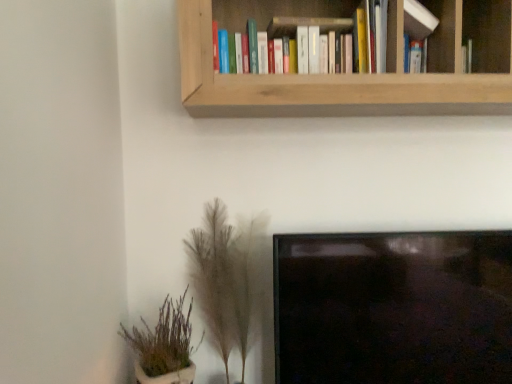
Question: Considering the relative sizes of green leafy plant at lower left, which is the 1th houseplant from left to right, and white matte book at upper right, the 2th book positioned from the left, in the image provided, is green leafy plant at lower left, which is the 1th houseplant from left to right, wider than white matte book at upper right, the 2th book positioned from the left,?

Choices:
 (A) no
 (B) yes

Answer: (B)

Question: Can you confirm if green leafy plant at lower left, which is the 1th houseplant from left to right, is positioned to the right of white matte book at upper right, marked as the first book in a right-to-left arrangement?

Choices:
 (A) yes
 (B) no

Answer: (B)

Question: Considering the relative sizes of green leafy plant at lower left, which is the 1th houseplant from left to right, and white matte book at upper right, the 2th book positioned from the left, in the image provided, is green leafy plant at lower left, which is the 1th houseplant from left to right, taller than white matte book at upper right, the 2th book positioned from the left,?

Choices:
 (A) no
 (B) yes

Answer: (B)

Question: Would you consider green leafy plant at lower left, the 2th houseplant from the right, to be distant from white matte book at upper right, the 2th book positioned from the left?

Choices:
 (A) no
 (B) yes

Answer: (B)

Question: From a real-world perspective, is green leafy plant at lower left, the 2th houseplant from the right, located beneath white matte book at upper right, marked as the first book in a right-to-left arrangement?

Choices:
 (A) no
 (B) yes

Answer: (B)

Question: Can you confirm if green leafy plant at lower left, which is the 1th houseplant from left to right, is positioned to the left of white matte book at upper right, marked as the first book in a right-to-left arrangement?

Choices:
 (A) no
 (B) yes

Answer: (B)

Question: Considering the relative sizes of green leafy plant at lower left, the 2th houseplant from the right, and fuzzy beige plant at lower center, positioned as the 1th houseplant in right-to-left order, in the image provided, is green leafy plant at lower left, the 2th houseplant from the right, wider than fuzzy beige plant at lower center, positioned as the 1th houseplant in right-to-left order,?

Choices:
 (A) no
 (B) yes

Answer: (A)

Question: Is green leafy plant at lower left, the 2th houseplant from the right, facing away from fuzzy beige plant at lower center, the second houseplant positioned from the left?

Choices:
 (A) yes
 (B) no

Answer: (B)

Question: Can you see green leafy plant at lower left, which is the 1th houseplant from left to right, touching fuzzy beige plant at lower center, positioned as the 1th houseplant in right-to-left order?

Choices:
 (A) yes
 (B) no

Answer: (B)

Question: Is green leafy plant at lower left, which is the 1th houseplant from left to right, positioned far away from fuzzy beige plant at lower center, the second houseplant positioned from the left?

Choices:
 (A) yes
 (B) no

Answer: (B)

Question: Can we say green leafy plant at lower left, which is the 1th houseplant from left to right, lies outside fuzzy beige plant at lower center, the second houseplant positioned from the left?

Choices:
 (A) yes
 (B) no

Answer: (A)

Question: From the image's perspective, is green leafy plant at lower left, the 2th houseplant from the right, above fuzzy beige plant at lower center, the second houseplant positioned from the left?

Choices:
 (A) no
 (B) yes

Answer: (A)

Question: From the image's perspective, is fuzzy beige plant at lower center, positioned as the 1th houseplant in right-to-left order, over wooden bookshelf at upper center?

Choices:
 (A) yes
 (B) no

Answer: (B)